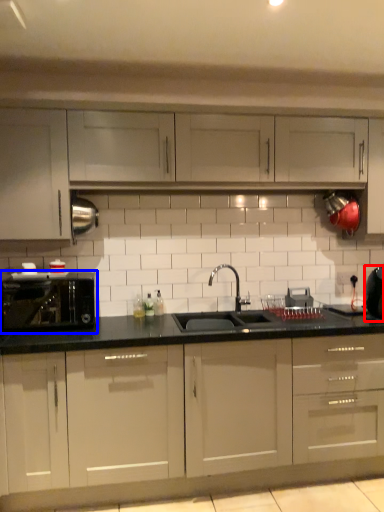
Question: Which point is closer to the camera, appliance (highlighted by a red box) or home appliance (highlighted by a blue box)?

Choices:
 (A) appliance
 (B) home appliance

Answer: (B)